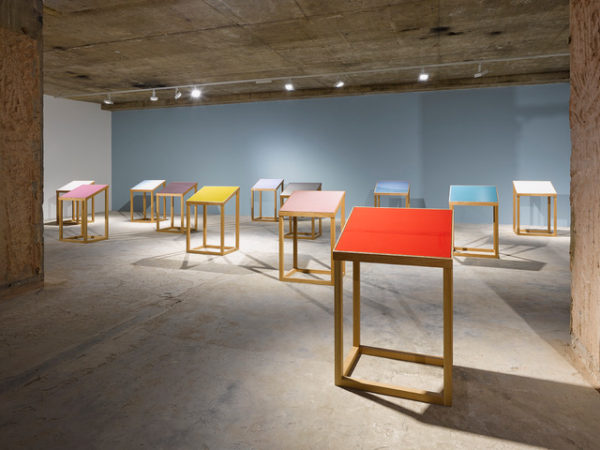
You are a GUI agent. You are given a task and a screenshot of the screen. Output one action in this format:
    pyautogui.click(x=<x>, y=<y>)
    Task: Click on the walls
    The height and width of the screenshot is (450, 600).
    Given the screenshot: What is the action you would take?
    [23, 183], [589, 231]